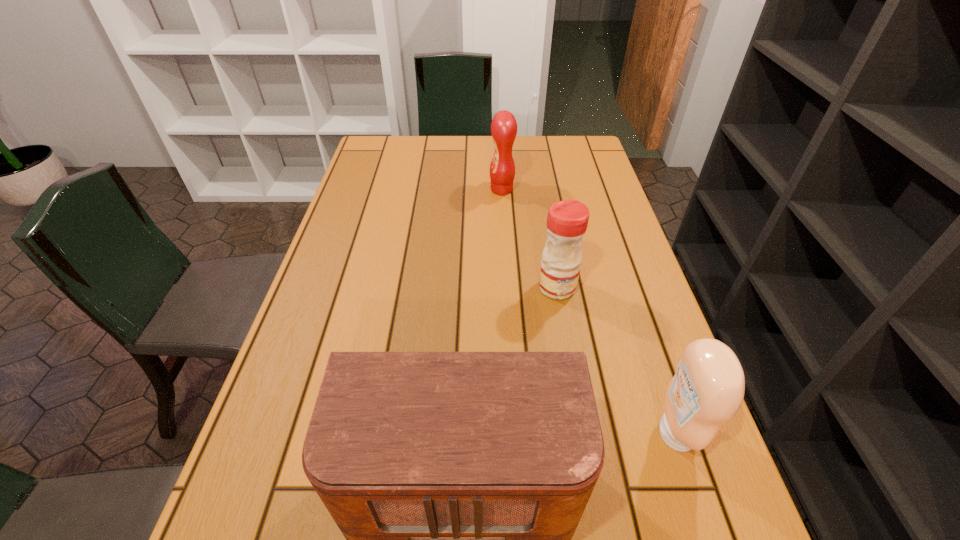
At what (x,y) coordinates should I click in order to perform the action: click on the farthest object. Please return your answer as a coordinate pair (x, y). The height and width of the screenshot is (540, 960). Looking at the image, I should click on (504, 126).

Find the location of a particular element. The height and width of the screenshot is (540, 960). the farthest condiment is located at coordinates (504, 126).

Find the location of a particular element. This screenshot has height=540, width=960. the second nearest condiment is located at coordinates (567, 221).

Where is `the third nearest object`? This screenshot has width=960, height=540. the third nearest object is located at coordinates (567, 221).

At what (x,y) coordinates should I click in order to perform the action: click on the rightmost condiment. Please return your answer as a coordinate pair (x, y). Image resolution: width=960 pixels, height=540 pixels. Looking at the image, I should click on (707, 390).

Find the location of a particular element. The width and height of the screenshot is (960, 540). the nearest condiment is located at coordinates (707, 390).

Identify the location of vacant region located 0.380m on the label side of the farthest object. This screenshot has height=540, width=960. click(x=364, y=190).

Where is `free spot located 0.390m on the label side of the farthest object`? This screenshot has height=540, width=960. free spot located 0.390m on the label side of the farthest object is located at coordinates (361, 190).

In order to click on vacant region located 0.400m on the label side of the farthest object in this screenshot , I will do `click(358, 190)`.

At what (x,y) coordinates should I click in order to perform the action: click on vacant space located on the front of the second condiment from left to right. Please return your answer as a coordinate pair (x, y). Looking at the image, I should click on (564, 321).